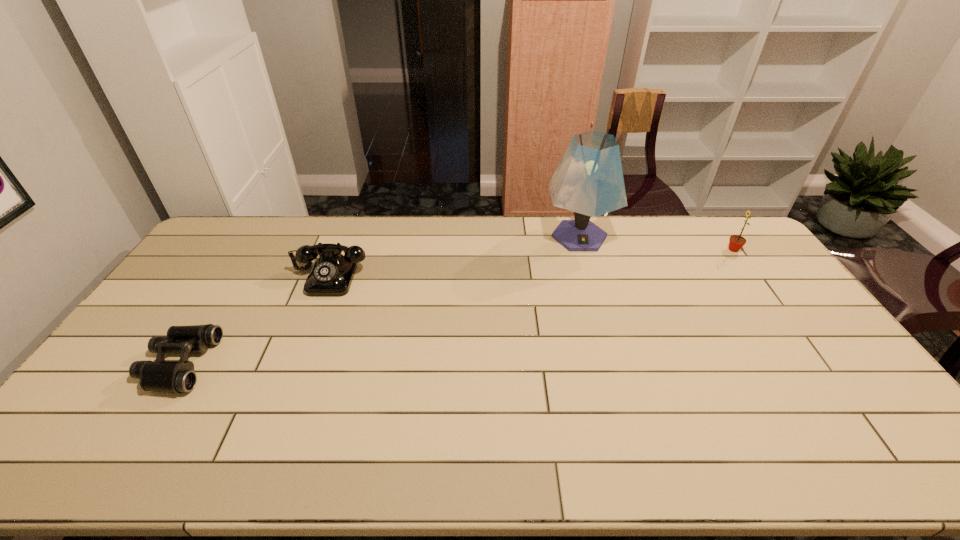
Find the location of a particular element. The image size is (960, 540). vacant space that satisfies the following two spatial constraints: 1. on the dial of the third tallest object; 2. on the front-facing side of the leftmost object is located at coordinates (296, 363).